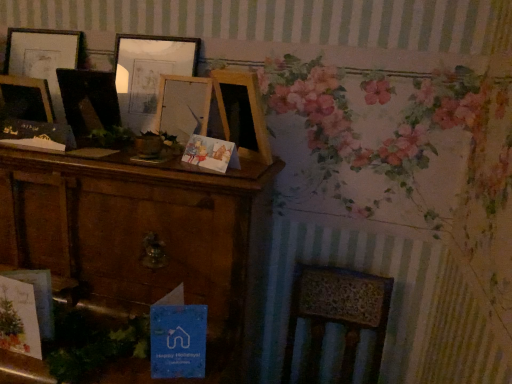
The width and height of the screenshot is (512, 384). What are the coordinates of `wooden picture frame at upper left, the third picture frame when ordered from right to left` in the screenshot? It's located at (42, 57).

You are a GUI agent. You are given a task and a screenshot of the screen. Output one action in this format:
    pyautogui.click(x=<x>, y=<y>)
    Task: Click on the brown wood cabinet at left
    This screenshot has width=512, height=384.
    Given the screenshot: What is the action you would take?
    pyautogui.click(x=144, y=242)

This screenshot has height=384, width=512. What do you see at coordinates (391, 305) in the screenshot? I see `wooden radiator at lower right` at bounding box center [391, 305].

You are a GUI agent. You are given a task and a screenshot of the screen. Output one action in this format:
    pyautogui.click(x=<x>, y=<y>)
    Task: Click on the wooden picture frame at left, arranged as the 2th picture frame when viewed from the right
    Image resolution: width=512 pixels, height=384 pixels.
    Given the screenshot: What is the action you would take?
    pyautogui.click(x=88, y=97)

In the scene shown: Can you tell me how much wooden radiator at lower right and wooden picture frame at upper left, the third picture frame when ordered from right to left, differ in facing direction?

The angular difference between wooden radiator at lower right and wooden picture frame at upper left, the third picture frame when ordered from right to left, is 0.18 degrees.

Consider the image. Is wooden radiator at lower right further to camera compared to wooden picture frame at upper left, the first picture frame when ordered from left to right?

No, it is not.

Considering the relative sizes of wooden radiator at lower right and wooden picture frame at upper left, the first picture frame when ordered from left to right, in the image provided, is wooden radiator at lower right taller than wooden picture frame at upper left, the first picture frame when ordered from left to right,?

Indeed, wooden radiator at lower right has a greater height compared to wooden picture frame at upper left, the first picture frame when ordered from left to right.

Is wooden radiator at lower right beside wooden picture frame at upper left, the third picture frame when ordered from right to left?

There is a gap between wooden radiator at lower right and wooden picture frame at upper left, the third picture frame when ordered from right to left.

Does brown wood cabinet at left have a greater height compared to wooden picture frame at left, arranged as the 2th picture frame when viewed from the right?

Indeed, brown wood cabinet at left has a greater height compared to wooden picture frame at left, arranged as the 2th picture frame when viewed from the right.

From the image's perspective, is brown wood cabinet at left located above or below wooden picture frame at left, which is the 2th picture frame from left to right?

brown wood cabinet at left is situated lower than wooden picture frame at left, which is the 2th picture frame from left to right, in the image.

Which is nearer, (44, 199) or (83, 70)?

Clearly, point (44, 199) is closer to the camera than point (83, 70).

Which picture frame is the 1st one when counting from the right side of the brown wood cabinet at left? Please provide its 2D coordinates.

[(88, 97)]

Which of these two, wooden picture frame at left, which is the 2th picture frame from left to right, or wooden picture frame at upper left, the third picture frame when ordered from right to left, is smaller?

Smaller between the two is wooden picture frame at left, which is the 2th picture frame from left to right.

Which point is more forward, (71,79) or (7,60)?

The point (71,79) is closer.

Is wooden picture frame at left, which is the 2th picture frame from left to right, looking in the opposite direction of wooden picture frame at upper left, the third picture frame when ordered from right to left?

wooden picture frame at left, which is the 2th picture frame from left to right, is not turned away from wooden picture frame at upper left, the third picture frame when ordered from right to left.

From the image's perspective, is wooden picture frame at left, arranged as the 2th picture frame when viewed from the right, on wooden picture frame at upper left, the third picture frame when ordered from right to left?

Incorrect, from the image's perspective, wooden picture frame at left, arranged as the 2th picture frame when viewed from the right, is lower than wooden picture frame at upper left, the third picture frame when ordered from right to left.

From a real-world perspective, which is physically above, wooden picture frame at center, placed as the first picture frame when sorted from right to left, or wooden picture frame at upper left, the first picture frame when ordered from left to right?

In real-world perspective, wooden picture frame at upper left, the first picture frame when ordered from left to right, is above.

Who is more distant, wooden picture frame at center, placed as the first picture frame when sorted from right to left, or wooden picture frame at upper left, the first picture frame when ordered from left to right?

wooden picture frame at upper left, the first picture frame when ordered from left to right, is behind.

Considering the sizes of objects wooden picture frame at center, which is the third picture frame in left-to-right order, and wooden picture frame at upper left, the third picture frame when ordered from right to left, in the image provided, who is bigger, wooden picture frame at center, which is the third picture frame in left-to-right order, or wooden picture frame at upper left, the third picture frame when ordered from right to left,?

With larger size is wooden picture frame at center, which is the third picture frame in left-to-right order.

Is wooden radiator at lower right wider or thinner than wooden picture frame at center, which is the third picture frame in left-to-right order?

wooden radiator at lower right is wider than wooden picture frame at center, which is the third picture frame in left-to-right order.

At what (x,y) coordinates should I click in order to perform the action: click on picture frame that is the 2nd one when counting upward from the wooden radiator at lower right (from the image's perspective). Please return your answer as a coordinate pair (x, y). The height and width of the screenshot is (384, 512). Looking at the image, I should click on click(x=149, y=73).

Considering the relative positions of wooden radiator at lower right and wooden picture frame at center, placed as the first picture frame when sorted from right to left, in the image provided, is wooden radiator at lower right to the right of wooden picture frame at center, placed as the first picture frame when sorted from right to left, from the viewer's perspective?

Correct, you'll find wooden radiator at lower right to the right of wooden picture frame at center, placed as the first picture frame when sorted from right to left.

Is wooden radiator at lower right bigger than wooden picture frame at center, placed as the first picture frame when sorted from right to left?

Indeed, wooden radiator at lower right has a larger size compared to wooden picture frame at center, placed as the first picture frame when sorted from right to left.

Is wooden picture frame at upper left, the first picture frame when ordered from left to right, further to camera compared to brown wood cabinet at left?

Yes, wooden picture frame at upper left, the first picture frame when ordered from left to right, is further from the viewer.

In terms of height, does wooden picture frame at upper left, the first picture frame when ordered from left to right, look taller or shorter compared to brown wood cabinet at left?

In the image, wooden picture frame at upper left, the first picture frame when ordered from left to right, appears to be shorter than brown wood cabinet at left.

Which of these two, wooden picture frame at upper left, the first picture frame when ordered from left to right, or brown wood cabinet at left, is smaller?

With smaller size is wooden picture frame at upper left, the first picture frame when ordered from left to right.

From a real-world perspective, is wooden picture frame at upper left, the first picture frame when ordered from left to right, positioned under brown wood cabinet at left based on gravity?

Actually, wooden picture frame at upper left, the first picture frame when ordered from left to right, is physically above brown wood cabinet at left in the real world.

Is wooden picture frame at left, arranged as the 2th picture frame when viewed from the right, taller or shorter than wooden radiator at lower right?

In the image, wooden picture frame at left, arranged as the 2th picture frame when viewed from the right, appears to be shorter than wooden radiator at lower right.

Considering the relative sizes of wooden picture frame at left, arranged as the 2th picture frame when viewed from the right, and wooden radiator at lower right in the image provided, is wooden picture frame at left, arranged as the 2th picture frame when viewed from the right, bigger than wooden radiator at lower right?

No, wooden picture frame at left, arranged as the 2th picture frame when viewed from the right, is not bigger than wooden radiator at lower right.

Can you confirm if wooden picture frame at left, arranged as the 2th picture frame when viewed from the right, is positioned to the right of wooden radiator at lower right?

No.

From a real-world perspective, starting from the wooden radiator at lower right, which picture frame is the 3rd one vertically above it? Please provide its 2D coordinates.

[(42, 57)]

The height and width of the screenshot is (384, 512). In the image, there is a wooden picture frame at left, arranged as the 2th picture frame when viewed from the right. In order to click on cabinetry below it (from a real-world perspective) in this screenshot , I will do `click(144, 242)`.

Based on their spatial positions, is brown wood cabinet at left or blue paper postcard at lower center further from wooden picture frame at left, which is the 2th picture frame from left to right?

blue paper postcard at lower center.

Looking at the image, which one is located closer to wooden picture frame at center, placed as the first picture frame when sorted from right to left, brown wood cabinet at left or blue paper postcard at lower center?

Among the two, brown wood cabinet at left is located nearer to wooden picture frame at center, placed as the first picture frame when sorted from right to left.

Based on their spatial positions, is blue paper postcard at lower center or wooden picture frame at left, which is the 2th picture frame from left to right, closer to wooden picture frame at center, which is the third picture frame in left-to-right order?

Based on the image, wooden picture frame at left, which is the 2th picture frame from left to right, appears to be nearer to wooden picture frame at center, which is the third picture frame in left-to-right order.

Looking at this image, based on their spatial positions, is wooden radiator at lower right or wooden picture frame at left, arranged as the 2th picture frame when viewed from the right, closer to blue paper postcard at lower center?

wooden radiator at lower right lies closer to blue paper postcard at lower center than the other object.

Looking at the image, which one is located closer to wooden radiator at lower right, wooden picture frame at upper left, the third picture frame when ordered from right to left, or blue paper postcard at lower center?

The object closer to wooden radiator at lower right is blue paper postcard at lower center.

Looking at this image, which object lies further to the anchor point wooden picture frame at left, arranged as the 2th picture frame when viewed from the right, brown wood cabinet at left or wooden radiator at lower right?

Among the two, wooden radiator at lower right is located further to wooden picture frame at left, arranged as the 2th picture frame when viewed from the right.

When comparing their distances from wooden picture frame at upper left, the third picture frame when ordered from right to left, does wooden radiator at lower right or brown wood cabinet at left seem further?

Among the two, wooden radiator at lower right is located further to wooden picture frame at upper left, the third picture frame when ordered from right to left.

Looking at the image, which one is located further to wooden picture frame at upper left, the first picture frame when ordered from left to right, brown wood cabinet at left or wooden picture frame at left, arranged as the 2th picture frame when viewed from the right?

brown wood cabinet at left is positioned further to the anchor wooden picture frame at upper left, the first picture frame when ordered from left to right.

Locate an element on the screen. This screenshot has width=512, height=384. postcard between wooden picture frame at upper left, the first picture frame when ordered from left to right, and brown wood cabinet at left from top to bottom is located at coordinates (178, 341).

This screenshot has height=384, width=512. Identify the location of postcard between wooden picture frame at left, which is the 2th picture frame from left to right, and wooden radiator at lower right from top to bottom. (178, 341).

Identify the location of postcard situated between brown wood cabinet at left and wooden radiator at lower right from left to right. 178,341.

The width and height of the screenshot is (512, 384). Identify the location of cabinetry between wooden picture frame at center, placed as the first picture frame when sorted from right to left, and wooden radiator at lower right from top to bottom. (144, 242).